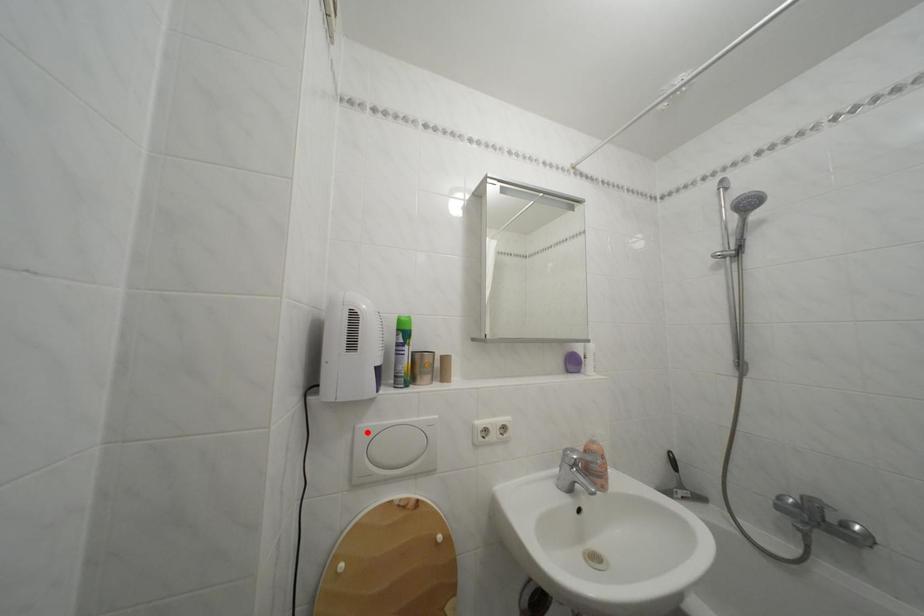
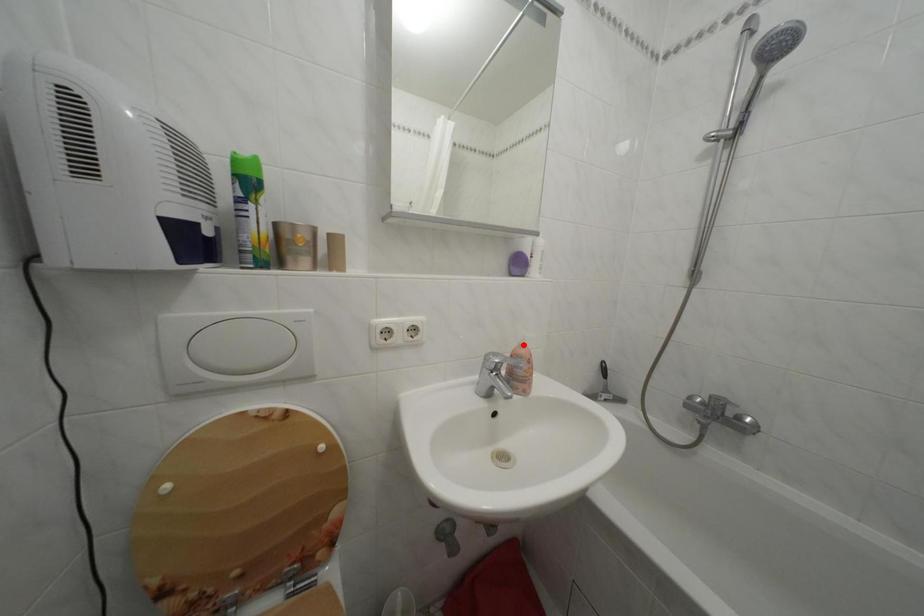
I am providing you with two images of the same scene from different viewpoints. A red point is marked on the first image and another point is marked on the second image. Do the highlighted points in image1 and image2 indicate the same real-world spot?

No